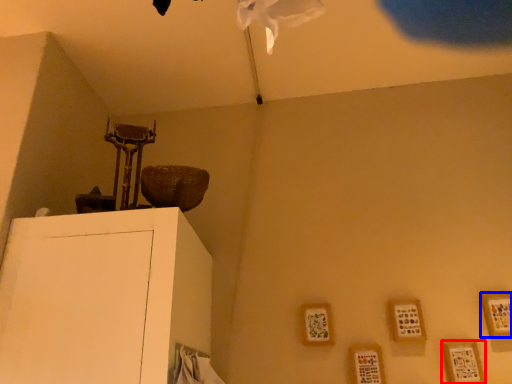
Question: Among these objects, which one is farthest to the camera, picture frame (highlighted by a red box) or picture frame (highlighted by a blue box)?

Choices:
 (A) picture frame
 (B) picture frame

Answer: (B)